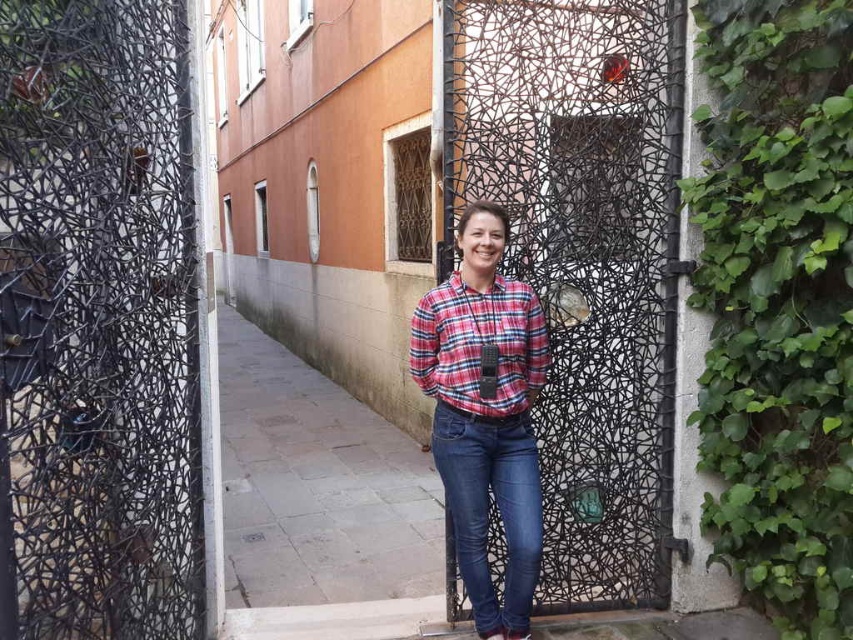
You are a tailor measuring the distance between two shirts for a fitting. The plaid cotton shirt at center and the plaid fabric shirt at center are both in front of you. Can you fit a 5.5 inch ruler between them?

The plaid cotton shirt at center and plaid fabric shirt at center are 5.45 inches apart, so the 5.5 inch ruler cannot fit between them as the distance is slightly less than the ruler length.

You are a painter standing 2 meters away from the green leafy ivy at right. You want to paint the ivy but need to be within 2 meters to capture details. Can you move closer to the ivy?

The distance between you and the green leafy ivy at right is 2.43 meters. Since you need to be within 2 meters, you should move 0.43 meters closer to the ivy to achieve the desired proximity.

Looking at this image, you are a photographer trying to capture a clear shot of the black textured gate at center while standing in front of it. However, the plaid cotton shirt at center is blocking part of the gate. Can you estimate if the gate is wide enough to fit into the frame without the shirt obstructing it?

The black textured gate at center might be wider than plaid cotton shirt at center, so there is a possibility that the gate could be framed without obstruction. However, since the exact width difference isn not specified, it is recommended to adjust your position slightly to ensure the entire gate is visible.